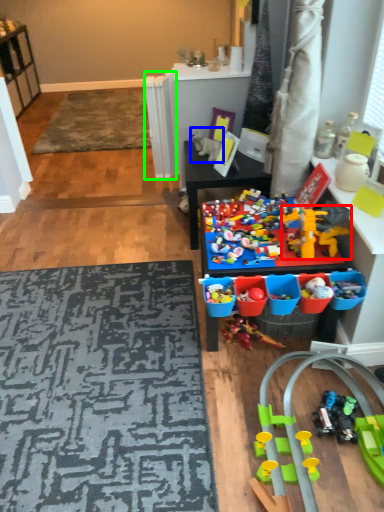
Question: Which object is the closest to the toy (highlighted by a red box)? Choose among these: toy (highlighted by a blue box) or radiator (highlighted by a green box).

Choices:
 (A) toy
 (B) radiator

Answer: (A)